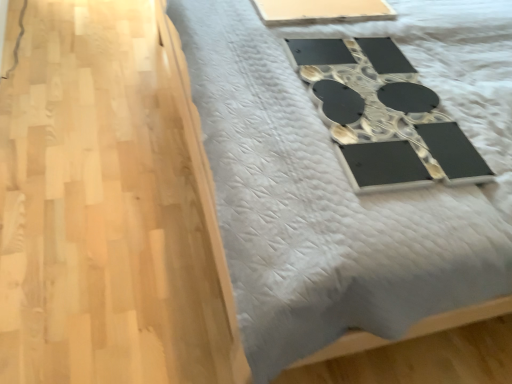
Question: Do you think white plastic tray at upper center is within black glossy mirror at upper center, or outside of it?

Choices:
 (A) inside
 (B) outside

Answer: (B)

Question: In the image, is white plastic tray at upper center positioned in front of or behind black glossy mirror at upper center?

Choices:
 (A) behind
 (B) front

Answer: (A)

Question: From the image's perspective, relative to black glossy mirror at upper center, is white plastic tray at upper center above or below?

Choices:
 (A) below
 (B) above

Answer: (B)

Question: Is black glossy mirror at upper center spatially inside white plastic tray at upper center, or outside of it?

Choices:
 (A) outside
 (B) inside

Answer: (A)

Question: Considering the relative positions of black glossy mirror at upper center and white plastic tray at upper center in the image provided, is black glossy mirror at upper center to the left or to the right of white plastic tray at upper center?

Choices:
 (A) left
 (B) right

Answer: (A)

Question: From the image's perspective, is black glossy mirror at upper center positioned above or below white plastic tray at upper center?

Choices:
 (A) below
 (B) above

Answer: (A)

Question: Considering the positions of black glossy mirror at upper center and white plastic tray at upper center in the image, is black glossy mirror at upper center wider or thinner than white plastic tray at upper center?

Choices:
 (A) wide
 (B) thin

Answer: (A)